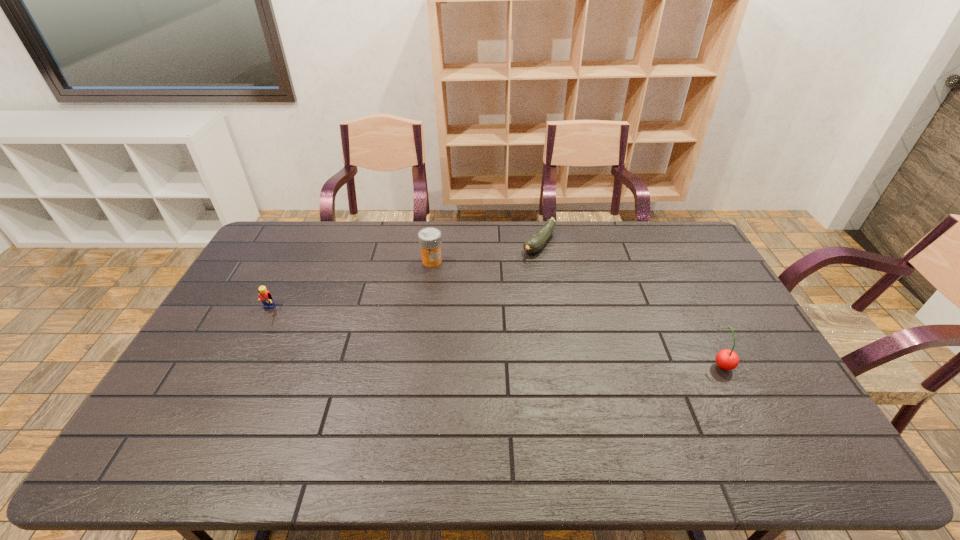
Locate an element on the screen. This screenshot has height=540, width=960. free spot between the medicine and the cherry is located at coordinates (577, 313).

Locate an element on the screen. The width and height of the screenshot is (960, 540). vacant space that is in between the Lego and the third object from left to right is located at coordinates (403, 278).

Identify the location of free space between the cherry and the leftmost object. Image resolution: width=960 pixels, height=540 pixels. (494, 338).

Identify the location of free space between the Lego and the zucchini. This screenshot has width=960, height=540. (403, 278).

Locate an element on the screen. This screenshot has height=540, width=960. vacant area that lies between the medicine and the Lego is located at coordinates (349, 286).

The height and width of the screenshot is (540, 960). What are the coordinates of `object that is the nearest to the leftmost object` in the screenshot? It's located at (430, 241).

Identify which object is the closest to the medicine. Please provide its 2D coordinates. Your answer should be formatted as a tuple, i.e. [(x, y)], where the tuple contains the x and y coordinates of a point satisfying the conditions above.

[(535, 242)]

At what (x,y) coordinates should I click in order to perform the action: click on free point that satisfies the following two spatial constraints: 1. on the front-facing side of the leftmost object; 2. on the right side of the cherry. Please return your answer as a coordinate pair (x, y). This screenshot has width=960, height=540. Looking at the image, I should click on (241, 364).

Find the location of `free space that satisfies the following two spatial constraints: 1. on the front-facing side of the second nearest object; 2. on the left side of the rightmost object`. free space that satisfies the following two spatial constraints: 1. on the front-facing side of the second nearest object; 2. on the left side of the rightmost object is located at coordinates (241, 364).

The image size is (960, 540). Identify the location of free spot that satisfies the following two spatial constraints: 1. on the front-facing side of the nearest object; 2. on the right side of the Lego. (241, 364).